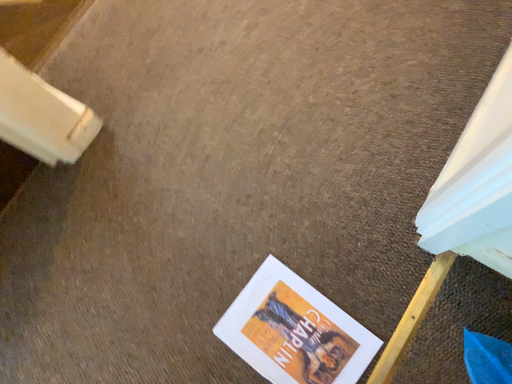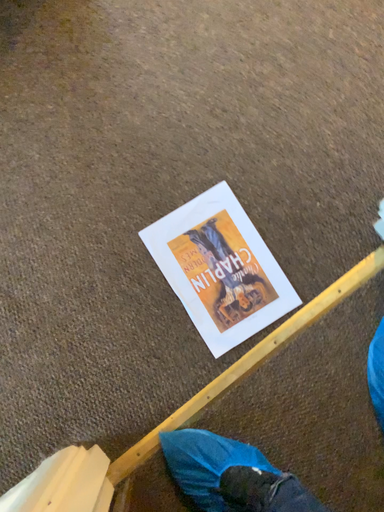
Question: Which way did the camera rotate in the video?

Choices:
 (A) rotated upward
 (B) rotated downward

Answer: (B)